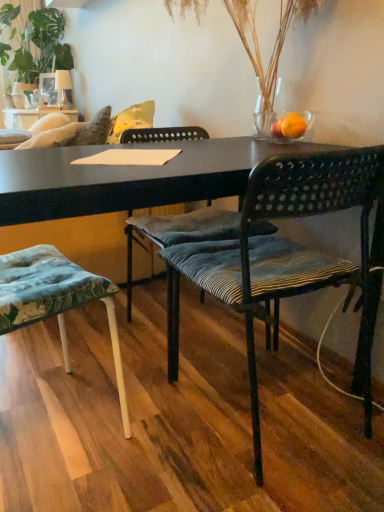
Question: Is textured fabric cushion at lower left, which is the 1th chair from left to right, inside black woven chair at center, acting as the 3th chair starting from the left?

Choices:
 (A) no
 (B) yes

Answer: (A)

Question: Does black woven chair at center, the 1th chair when ordered from right to left, have a greater height compared to textured fabric cushion at lower left, which is the 1th chair from left to right?

Choices:
 (A) yes
 (B) no

Answer: (A)

Question: From the image's perspective, is black woven chair at center, acting as the 3th chair starting from the left, on textured fabric cushion at lower left, acting as the third chair starting from the right?

Choices:
 (A) no
 (B) yes

Answer: (B)

Question: Can you confirm if black woven chair at center, the 1th chair when ordered from right to left, is positioned to the left of textured fabric cushion at lower left, which is the 1th chair from left to right?

Choices:
 (A) yes
 (B) no

Answer: (B)

Question: Considering the relative sizes of black woven chair at center, the 1th chair when ordered from right to left, and textured fabric cushion at lower left, which is the 1th chair from left to right, in the image provided, is black woven chair at center, the 1th chair when ordered from right to left, smaller than textured fabric cushion at lower left, which is the 1th chair from left to right,?

Choices:
 (A) no
 (B) yes

Answer: (A)

Question: Do you think orange matte glass at upper right is within green leafy plant at upper left, or outside of it?

Choices:
 (A) outside
 (B) inside

Answer: (A)

Question: From a real-world perspective, is orange matte glass at upper right physically located above or below green leafy plant at upper left?

Choices:
 (A) below
 (B) above

Answer: (A)

Question: Looking at their shapes, would you say orange matte glass at upper right is wider or thinner than green leafy plant at upper left?

Choices:
 (A) wide
 (B) thin

Answer: (B)

Question: Is orange matte glass at upper right bigger or smaller than green leafy plant at upper left?

Choices:
 (A) big
 (B) small

Answer: (B)

Question: Is point (240, 38) positioned closer to the camera than point (13, 32)?

Choices:
 (A) farther
 (B) closer

Answer: (B)

Question: Which is correct: clear glass vase at upper center is inside green leafy plant at upper left, or outside of it?

Choices:
 (A) inside
 (B) outside

Answer: (B)

Question: Is clear glass vase at upper center wider or thinner than green leafy plant at upper left?

Choices:
 (A) wide
 (B) thin

Answer: (B)

Question: Is clear glass vase at upper center bigger or smaller than green leafy plant at upper left?

Choices:
 (A) big
 (B) small

Answer: (B)

Question: Is green leafy plant at upper left in front of or behind black woven chair at center, the 1th chair when ordered from right to left, in the image?

Choices:
 (A) front
 (B) behind

Answer: (B)

Question: Is point (39, 25) closer or farther from the camera than point (382, 182)?

Choices:
 (A) closer
 (B) farther

Answer: (B)